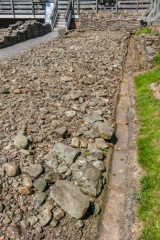
This screenshot has width=160, height=240. What are the coordinates of `stairs` in the screenshot? It's located at tap(59, 21).